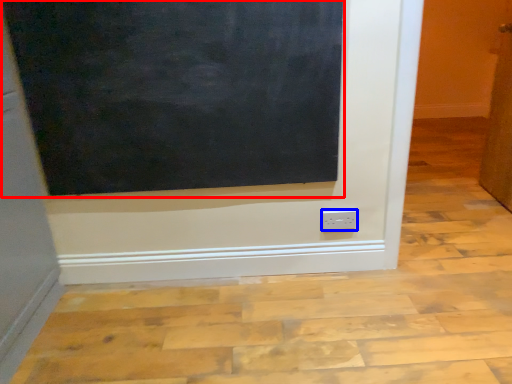
Question: Which of the following is the farthest to the observer, bulletin board (highlighted by a red box) or power plugs and sockets (highlighted by a blue box)?

Choices:
 (A) bulletin board
 (B) power plugs and sockets

Answer: (B)